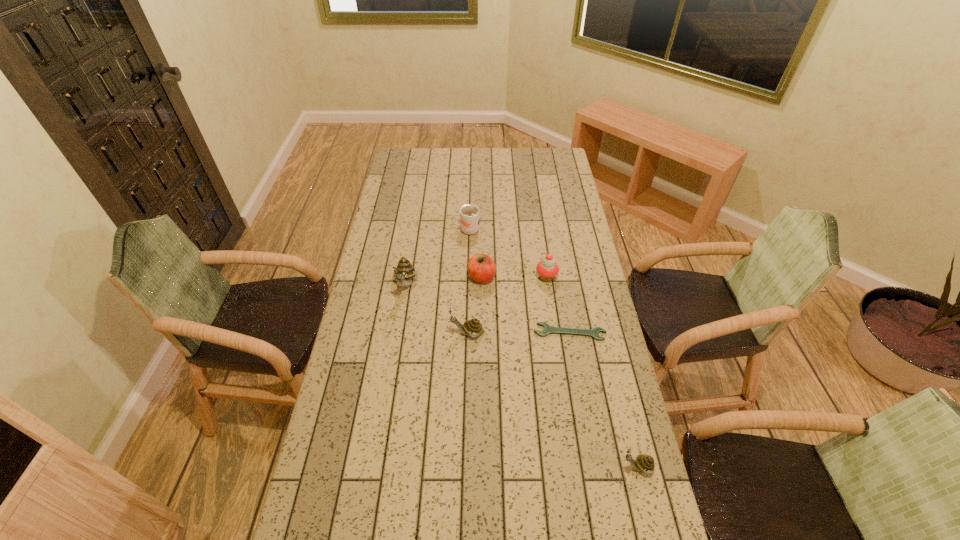
The height and width of the screenshot is (540, 960). Identify the location of free point at the near right corner. (628, 525).

Where is `vacant space in between the wrench and the nearest object`? vacant space in between the wrench and the nearest object is located at coordinates (604, 400).

Image resolution: width=960 pixels, height=540 pixels. Identify the location of free space between the rightmost snail and the cup. (552, 349).

Where is `free point between the tallest snail and the wrench`? The image size is (960, 540). free point between the tallest snail and the wrench is located at coordinates (488, 308).

Where is `vacant area that lies between the tallest snail and the cup`? vacant area that lies between the tallest snail and the cup is located at coordinates (437, 258).

What are the coordinates of `free space between the shortest snail and the second nearest snail` in the screenshot? It's located at (552, 400).

In order to click on free space between the wrench and the apple in this screenshot , I will do `click(526, 305)`.

At what (x,y) coordinates should I click in order to perform the action: click on free space between the second snail from right to left and the cup. Please return your answer as a coordinate pair (x, y). This screenshot has width=960, height=540. Looking at the image, I should click on (467, 282).

This screenshot has height=540, width=960. Find the location of `free space that is in between the rightmost snail and the apple`. free space that is in between the rightmost snail and the apple is located at coordinates [560, 372].

Locate an element on the screen. The image size is (960, 540). free spot between the cupcake and the second tallest snail is located at coordinates (507, 305).